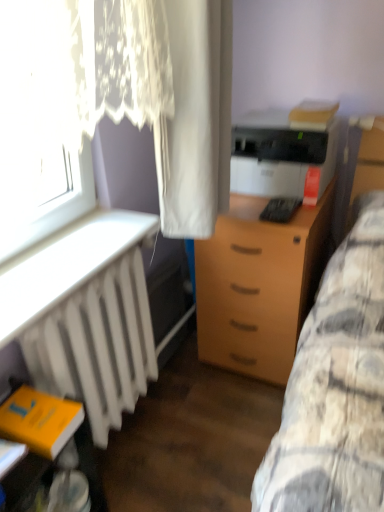
Measure the distance between white matte radiator at lower left and camera.

They are 34.76 inches apart.

Identify the location of white plastic radiator at left. The width and height of the screenshot is (384, 512). (65, 265).

Where is `white sheer curtain at upper left, which appears as the 1th curtain when viewed from the left`? This screenshot has width=384, height=512. white sheer curtain at upper left, which appears as the 1th curtain when viewed from the left is located at coordinates pyautogui.click(x=168, y=95).

At what (x,y) coordinates should I click in order to perform the action: click on yellow matte book at lower left. Please return your answer as a coordinate pair (x, y). The height and width of the screenshot is (512, 384). Looking at the image, I should click on (40, 420).

What are the coordinates of `matte black printer at center right` in the screenshot? It's located at (286, 152).

You are a GUI agent. You are given a task and a screenshot of the screen. Output one action in this format:
    pyautogui.click(x=<x>, y=<y>)
    Task: Click on the white matte radiator at lower left
    
    Given the screenshot: What is the action you would take?
    pyautogui.click(x=85, y=314)

Would you say matte black printer at center right is a long distance from white plastic radiator at left?

No, matte black printer at center right is not far from white plastic radiator at left.

Between matte black printer at center right and white plastic radiator at left, which one appears on the left side from the viewer's perspective?

white plastic radiator at left.

Considering the relative sizes of matte black printer at center right and white plastic radiator at left in the image provided, is matte black printer at center right wider than white plastic radiator at left?

Correct, the width of matte black printer at center right exceeds that of white plastic radiator at left.

Is matte black printer at center right located outside white plastic radiator at left?

matte black printer at center right lies outside white plastic radiator at left's area.

From the picture: From the image's perspective, is white sheer curtain at upper left, positioned as the second curtain in right-to-left order, located above or below yellow matte book at lower left?

Based on their image positions, white sheer curtain at upper left, positioned as the second curtain in right-to-left order, is located above yellow matte book at lower left.

Is white sheer curtain at upper left, positioned as the second curtain in right-to-left order, taller than yellow matte book at lower left?

Correct, white sheer curtain at upper left, positioned as the second curtain in right-to-left order, is much taller as yellow matte book at lower left.

Does point (187, 176) appear closer or farther from the camera than point (46, 448)?

Point (187, 176) is positioned farther from the camera compared to point (46, 448).

How many degrees apart are the facing directions of white sheer curtain at upper left, positioned as the second curtain in right-to-left order, and yellow matte book at lower left?

The angular difference between white sheer curtain at upper left, positioned as the second curtain in right-to-left order, and yellow matte book at lower left is 91.6 degrees.

From the image's perspective, which object appears higher, white plastic radiator at left or yellow matte book at lower left?

From the image's view, white plastic radiator at left is above.

What's the angular difference between white plastic radiator at left and yellow matte book at lower left's facing directions?

There is a 1.59-degree angle between the facing directions of white plastic radiator at left and yellow matte book at lower left.

Is white plastic radiator at left far away from yellow matte book at lower left?

No, white plastic radiator at left is not far from yellow matte book at lower left.

Between point (97, 248) and point (12, 414), which one is positioned behind?

The point (97, 248) is farther from the camera.

Is white matte radiator at lower left inside the boundaries of black plastic keyboard at center, or outside?

white matte radiator at lower left is located beyond the bounds of black plastic keyboard at center.

From a real-world perspective, which is physically above, white matte radiator at lower left or black plastic keyboard at center?

From a 3D spatial view, black plastic keyboard at center is above.

Is white matte radiator at lower left at the right side of black plastic keyboard at center?

Answer: Incorrect, white matte radiator at lower left is not on the right side of black plastic keyboard at center.

From the image's perspective, which one is positioned lower, white matte radiator at lower left or black plastic keyboard at center?

white matte radiator at lower left, from the image's perspective.

Is light brown wood drawer at center at the back of white matte radiator at lower left?

No, white matte radiator at lower left is not facing the opposite direction of light brown wood drawer at center.

Is the surface of white matte radiator at lower left in direct contact with light brown wood drawer at center?

There is a gap between white matte radiator at lower left and light brown wood drawer at center.

Is white matte radiator at lower left inside the boundaries of light brown wood drawer at center, or outside?

white matte radiator at lower left is not inside light brown wood drawer at center, it's outside.

Locate an element on the screen. Image resolution: width=384 pixels, height=512 pixels. desk on the left of light brown wood drawer at center is located at coordinates click(x=85, y=314).

Is matte black printer at center right not within white sheer curtain at upper left, which appears as the 1th curtain when viewed from the left?

Yes, matte black printer at center right is not within white sheer curtain at upper left, which appears as the 1th curtain when viewed from the left.

Could you tell me if matte black printer at center right is facing white sheer curtain at upper left, positioned as the second curtain in right-to-left order?

No.

Is point (293, 145) farther from camera compared to point (116, 52)?

Yes, it is.

Is matte black printer at center right at the left side of white sheer curtain at upper left, which appears as the 1th curtain when viewed from the left?

No, matte black printer at center right is not to the left of white sheer curtain at upper left, which appears as the 1th curtain when viewed from the left.

From the image's perspective, who appears lower, white plastic radiator at left or white matte radiator at lower left?

white matte radiator at lower left is shown below in the image.

From a real-world perspective, between white plastic radiator at left and white matte radiator at lower left, who is vertically lower?

white matte radiator at lower left, from a real-world perspective.

Is white plastic radiator at left in front of or behind white matte radiator at lower left in the image?

Visually, white plastic radiator at left is located in front of white matte radiator at lower left.

Is white plastic radiator at left wider or thinner than white matte radiator at lower left?

In the image, white plastic radiator at left appears to be wider than white matte radiator at lower left.

Where is `table below the matte black printer at center right (from the image's perspective)`? The height and width of the screenshot is (512, 384). table below the matte black printer at center right (from the image's perspective) is located at coordinates (65, 265).

This screenshot has height=512, width=384. Identify the location of the 1st curtain to the right of the yellow matte book at lower left, starting your count from the anchor. 168,95.

When comparing their distances from white plastic radiator at left, does black plastic keyboard at center or white matte radiator at lower left seem further?

black plastic keyboard at center.

Looking at the image, which one is located further to white sheer curtain at upper left, positioned as the second curtain in right-to-left order, white matte radiator at lower left or white fabric curtain at center, the 2th curtain in the left-to-right sequence?

Based on the image, white matte radiator at lower left appears to be further to white sheer curtain at upper left, positioned as the second curtain in right-to-left order.

From the image, which object appears to be nearer to matte black printer at center right, white plastic radiator at left or white matte radiator at lower left?

Among the two, white plastic radiator at left is located nearer to matte black printer at center right.

From the image, which object appears to be nearer to white fabric curtain at center, marked as the 1th curtain in a right-to-left arrangement, white sheer curtain at upper left, positioned as the second curtain in right-to-left order, or white plastic radiator at left?

The object closer to white fabric curtain at center, marked as the 1th curtain in a right-to-left arrangement, is white sheer curtain at upper left, positioned as the second curtain in right-to-left order.

From the image, which object appears to be nearer to white plastic radiator at left, black plastic keyboard at center or white fabric curtain at center, marked as the 1th curtain in a right-to-left arrangement?

white fabric curtain at center, marked as the 1th curtain in a right-to-left arrangement, is closer to white plastic radiator at left.

Considering their positions, is yellow matte book at lower left positioned closer to white plastic radiator at left than matte black printer at center right?

yellow matte book at lower left lies closer to white plastic radiator at left than the other object.

From the picture: Considering their positions, is yellow matte book at lower left positioned closer to white matte radiator at lower left than black plastic keyboard at center?

The object closer to white matte radiator at lower left is yellow matte book at lower left.

Which object lies further to the anchor point white matte radiator at lower left, matte black printer at center right or white sheer curtain at upper left, positioned as the second curtain in right-to-left order?

matte black printer at center right lies further to white matte radiator at lower left than the other object.

Find the location of a particular element. This screenshot has height=512, width=384. desk between white plastic radiator at left and light brown wood drawer at center from left to right is located at coordinates (85, 314).

Identify the location of desk that lies between white plastic radiator at left and yellow matte book at lower left from top to bottom. The image size is (384, 512). (85, 314).

Locate an element on the screen. This screenshot has width=384, height=512. equipment between yellow matte book at lower left and light brown wood drawer at center is located at coordinates (280, 209).

The width and height of the screenshot is (384, 512). Find the location of `equipment between white sheer curtain at upper left, positioned as the second curtain in right-to-left order, and light brown wood drawer at center, in the horizontal direction`. equipment between white sheer curtain at upper left, positioned as the second curtain in right-to-left order, and light brown wood drawer at center, in the horizontal direction is located at coordinates (280, 209).